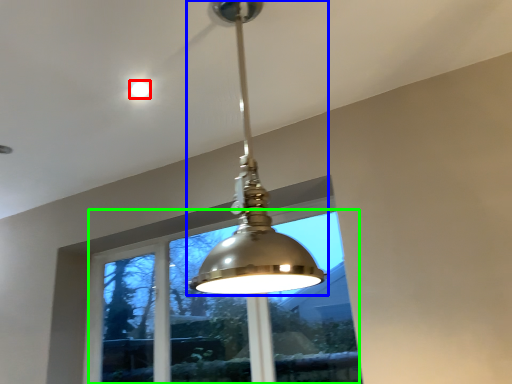
Question: Estimate the real-world distances between objects in this image. Which object is closer to droplight (highlighted by a red box), lamp (highlighted by a blue box) or window (highlighted by a green box)?

Choices:
 (A) lamp
 (B) window

Answer: (A)